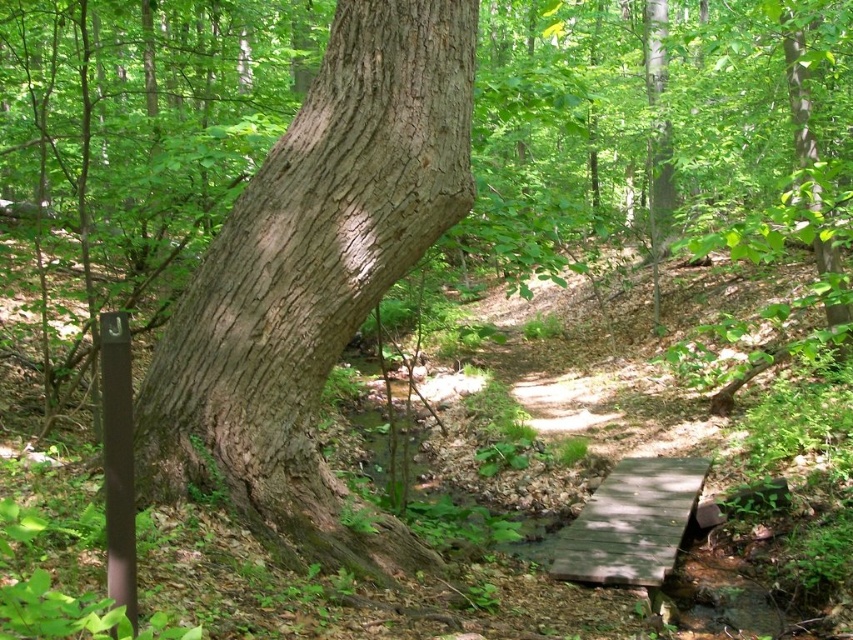
You are a hiker with a 4 meter long measuring tape. You want to measure the distance between yourself and the brown rough bark tree trunk at center. Can your measuring tape reach the tree trunk?

The brown rough bark tree trunk at center and camera are 4.36 meters apart from each other. Since your measuring tape is only 4 meters long, it cannot reach the tree trunk.

You are a hiker who wants to cross the wooden bridge at center without touching the brown rough bark tree trunk at center. Is there enough space between them for you to pass through?

The brown rough bark tree trunk at center is in front of the wooden bridge at center, so there is no space between them for you to pass through without touching the tree trunk.

You are a hiker carrying a backpack and need to cross the wooden bridge at center. The brown rough bark tree trunk at center is in your path. Can you walk around the tree trunk to reach the bridge?

The brown rough bark tree trunk at center has a lesser width compared to wooden bridge at center, so yes, you can walk around the tree trunk to reach the wooden bridge at center since the bridge is wider and provides enough space.